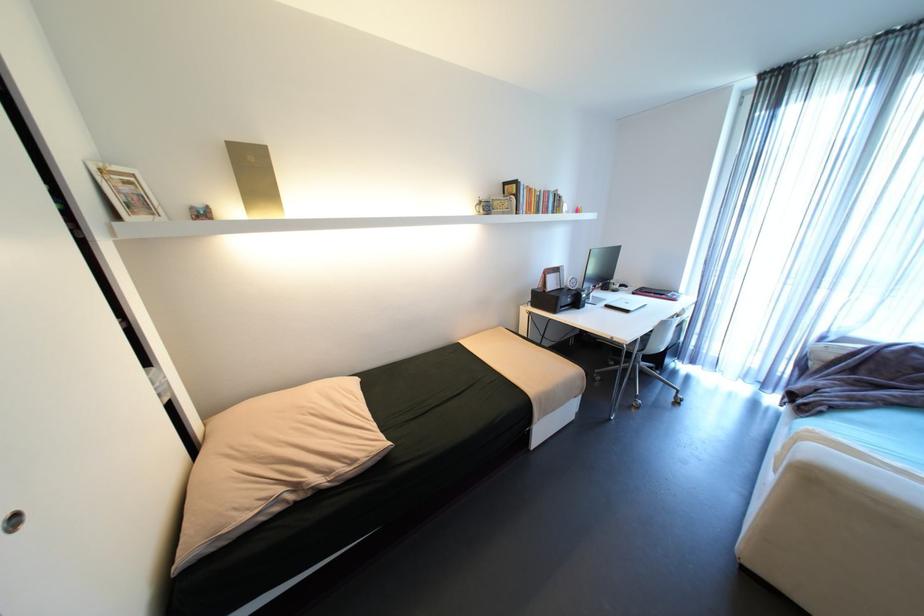
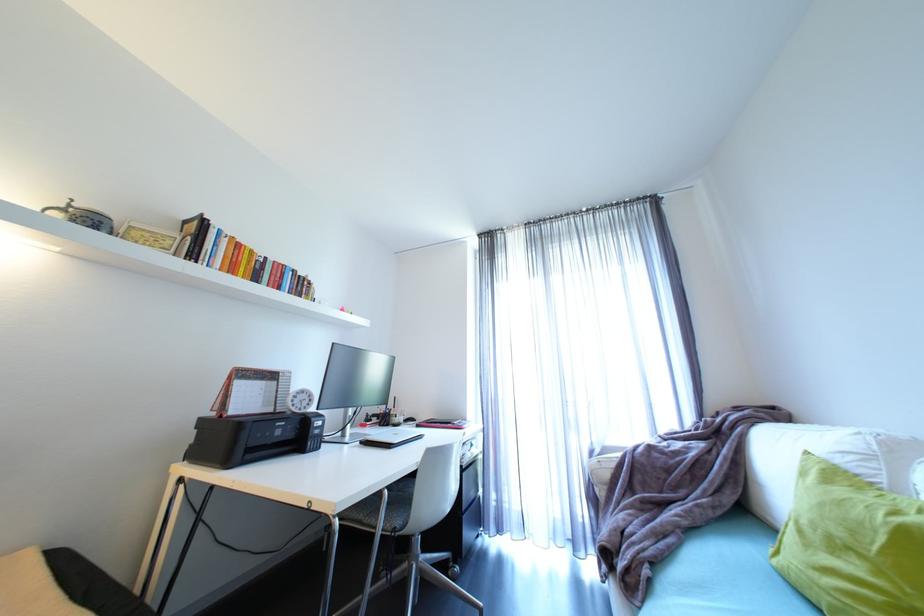
The point at (552, 292) is marked in the first image. Where is the corresponding point in the second image?

(228, 416)